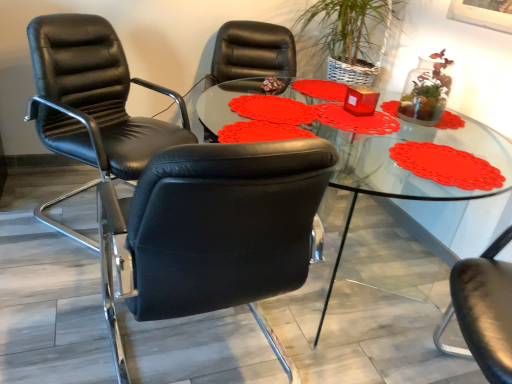
Question: Should I look upward or downward to see black leather chair at left, the second chair viewed from the back?

Choices:
 (A) down
 (B) up

Answer: (A)

Question: Is black leather chair at left, the second chair viewed from the back, far from black leather chair at left, the 1th chair when ordered from back to front?

Choices:
 (A) yes
 (B) no

Answer: (B)

Question: Is black leather chair at left, marked as the first chair in a front-to-back arrangement, completely or partially outside of black leather chair at left, which is the 2th chair from front to back?

Choices:
 (A) yes
 (B) no

Answer: (A)

Question: From a real-world perspective, is black leather chair at left, marked as the first chair in a front-to-back arrangement, on black leather chair at left, the 1th chair when ordered from back to front?

Choices:
 (A) yes
 (B) no

Answer: (B)

Question: Is the depth of black leather chair at left, marked as the first chair in a front-to-back arrangement, less than that of black leather chair at left, which is the 2th chair from front to back?

Choices:
 (A) no
 (B) yes

Answer: (B)

Question: Does black leather chair at left, the second chair viewed from the back, turn towards black leather chair at left, which is the 2th chair from front to back?

Choices:
 (A) no
 (B) yes

Answer: (B)

Question: Considering the relative sizes of black leather chair at left, the second chair viewed from the back, and black leather chair at left, which is the 2th chair from front to back, in the image provided, is black leather chair at left, the second chair viewed from the back, bigger than black leather chair at left, which is the 2th chair from front to back,?

Choices:
 (A) no
 (B) yes

Answer: (A)

Question: Is black leather chair at left, which is the 2th chair from front to back, wider than transparent glass table at center?

Choices:
 (A) no
 (B) yes

Answer: (A)

Question: From the image's perspective, is black leather chair at left, which is the 2th chair from front to back, under transparent glass table at center?

Choices:
 (A) no
 (B) yes

Answer: (A)

Question: Considering the relative sizes of black leather chair at left, which is the 2th chair from front to back, and transparent glass table at center in the image provided, is black leather chair at left, which is the 2th chair from front to back, shorter than transparent glass table at center?

Choices:
 (A) yes
 (B) no

Answer: (B)

Question: From a real-world perspective, does black leather chair at left, the 1th chair when ordered from back to front, stand above transparent glass table at center?

Choices:
 (A) no
 (B) yes

Answer: (B)

Question: Would you say transparent glass table at center is part of black leather chair at left, the 1th chair when ordered from back to front,'s contents?

Choices:
 (A) no
 (B) yes

Answer: (A)

Question: Is transparent glass table at center aimed at black leather chair at left, the second chair viewed from the back?

Choices:
 (A) yes
 (B) no

Answer: (B)